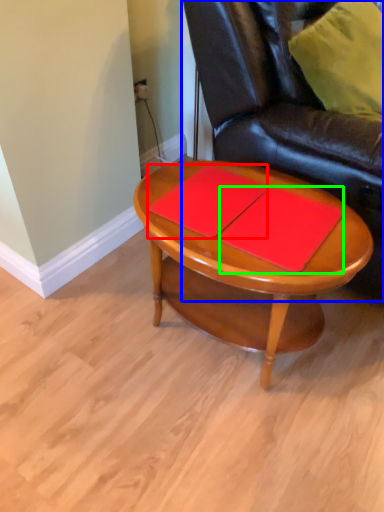
Question: Which object is positioned closest to notebook (highlighted by a red box)? Select from chair (highlighted by a blue box) and notebook (highlighted by a green box).

Choices:
 (A) chair
 (B) notebook

Answer: (B)